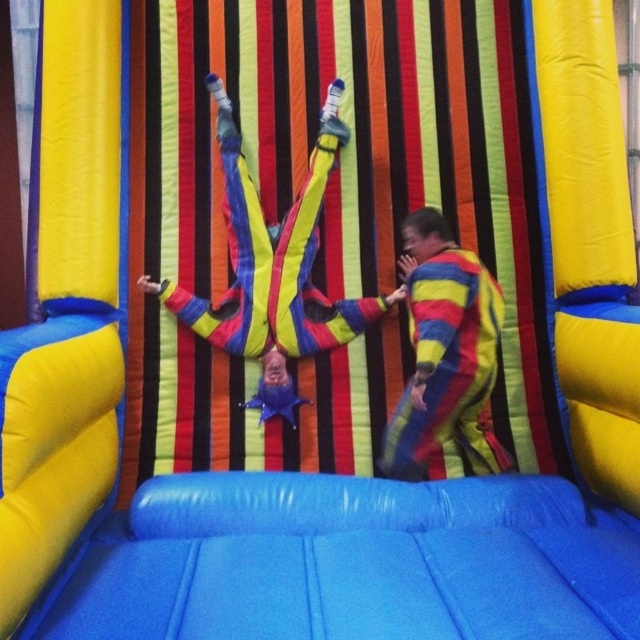
Consider the image. Is striped fabric pants at center below striped fabric clown at center?

No.

Is striped fabric pants at center smaller than striped fabric clown at center?

Indeed, striped fabric pants at center has a smaller size compared to striped fabric clown at center.

Does point (230, 285) lie behind point (424, 346)?

That is True.

In order to click on striped fabric pants at center in this screenshot , I will do `click(275, 260)`.